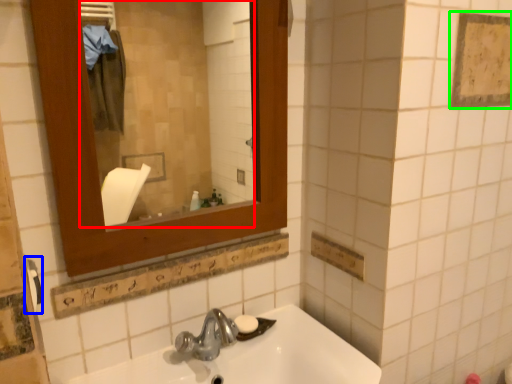
Question: Estimate the real-world distances between objects in this image. Which object is farther from mirror (highlighted by a red box), towel bar (highlighted by a blue box) or square (highlighted by a green box)?

Choices:
 (A) towel bar
 (B) square

Answer: (A)